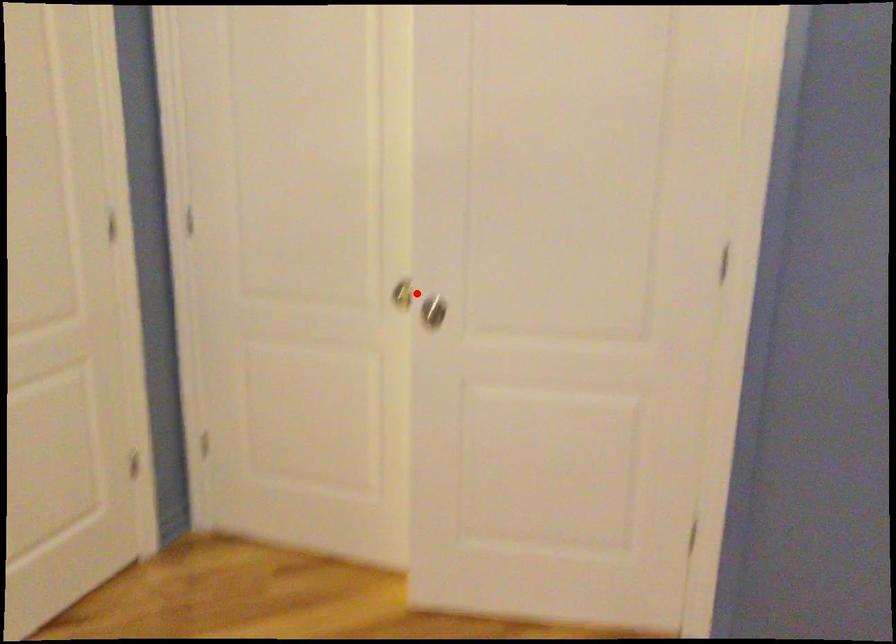
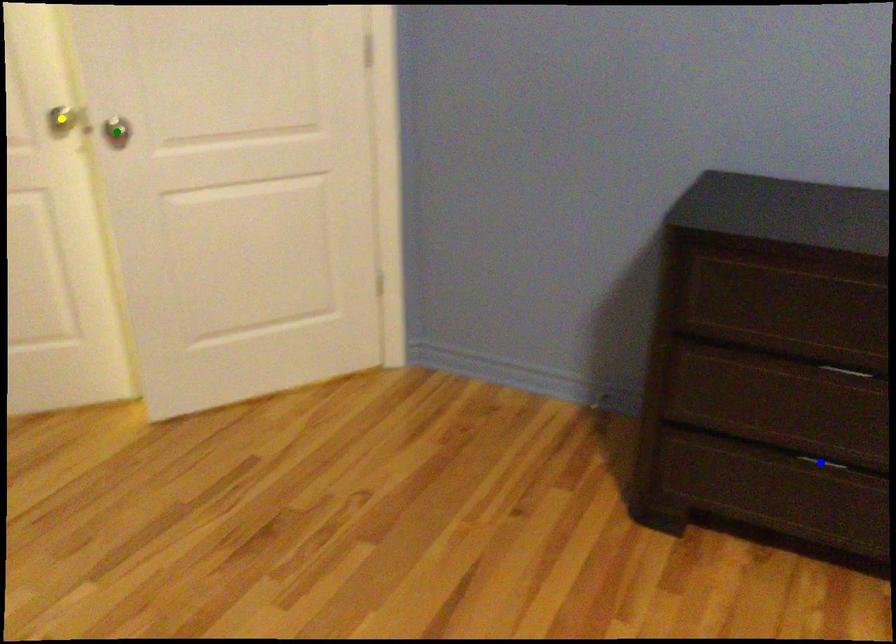
Question: I am providing you with two images of the same scene from different viewpoints. A red point is marked on the first image. You are given multiple points on the second image. Can you choose the point in image 2 that corresponds to the point in image 1?

Choices:
 (A) green point
 (B) blue point
 (C) yellow point

Answer: (C)